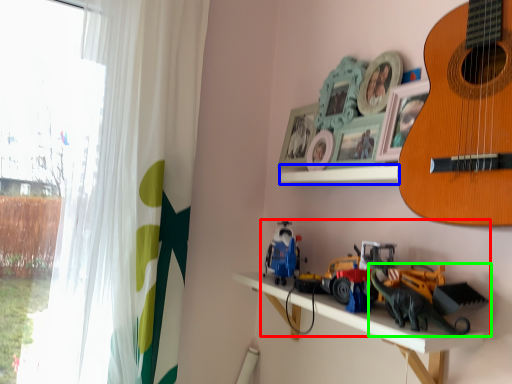
Question: Considering the real-world distances, which object is farthest from toy (highlighted by a red box)? window sill (highlighted by a blue box) or toy (highlighted by a green box)?

Choices:
 (A) window sill
 (B) toy

Answer: (A)